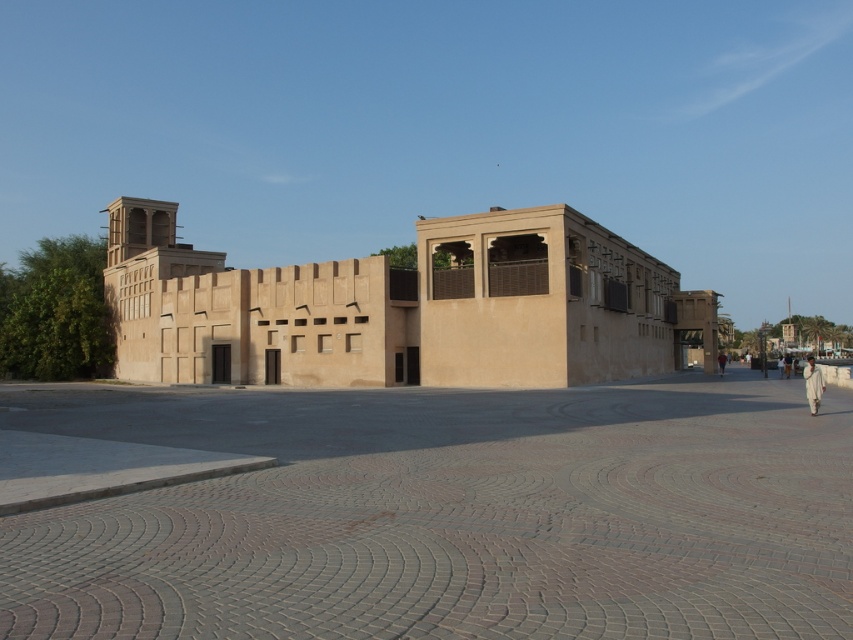
Question: Is beige sandstone building at center closer to camera compared to white cotton clothing at right?

Choices:
 (A) no
 (B) yes

Answer: (A)

Question: Which is nearer to the light beige sand-colored person at center-right?

Choices:
 (A) light brown sand-colored person at right
 (B) smooth sandstone plaza at center

Answer: (A)

Question: From the image, what is the correct spatial relationship of light beige sand-colored person at center-right in relation to light brown sand-colored person at right?

Choices:
 (A) above
 (B) below

Answer: (B)

Question: Does beige sandstone building at center appear on the left side of light beige sand-colored person at center-right?

Choices:
 (A) no
 (B) yes

Answer: (B)

Question: Which is nearer to the beige sandstone building at center?

Choices:
 (A) light beige sand-colored person at center-right
 (B) white cotton clothing at right
 (C) light brown sand-colored person at right
 (D) smooth sandstone plaza at center

Answer: (D)

Question: Which object appears closest to the camera in this image?

Choices:
 (A) light brown sand-colored person at right
 (B) light beige sand-colored person at center-right
 (C) smooth sandstone plaza at center

Answer: (C)